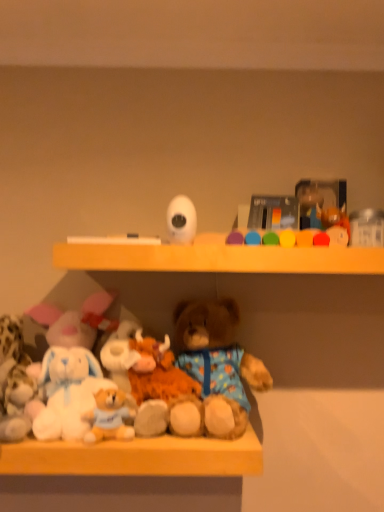
Image resolution: width=384 pixels, height=512 pixels. I want to click on empty space that is to the right of fluffy beige teddy bear at lower left, the fourth toy positioned from the top, so click(x=176, y=436).